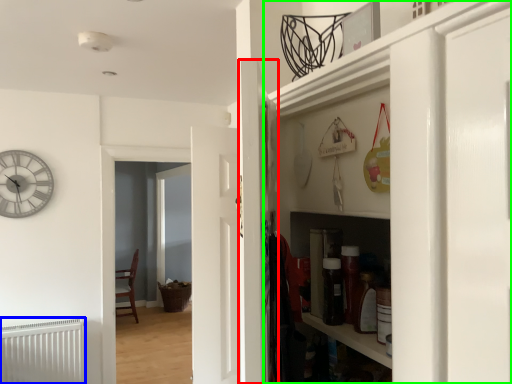
Question: Considering the real-world distances, which object is closest to door (highlighted by a red box)? radiator (highlighted by a blue box) or cabinetry (highlighted by a green box).

Choices:
 (A) radiator
 (B) cabinetry

Answer: (B)